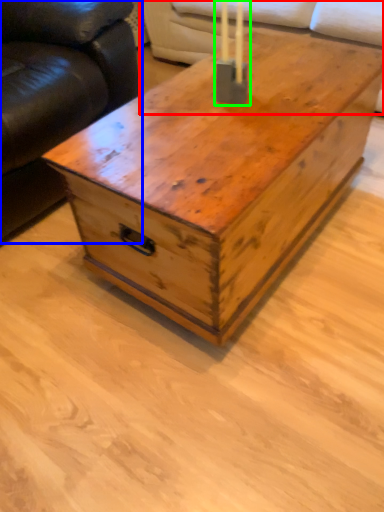
Question: Considering the real-world distances, which object is closest to couch (highlighted by a red box)? studio couch (highlighted by a blue box) or candle holder (highlighted by a green box).

Choices:
 (A) studio couch
 (B) candle holder

Answer: (A)